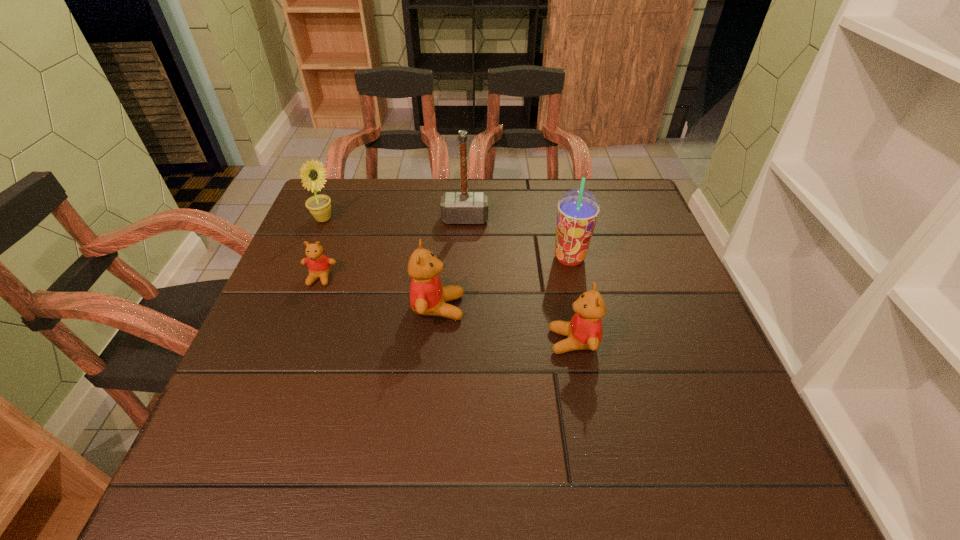
All teddy bears are currently evenly spaced. To continue this pattern, where would you add another teddy bear on the right? Please point out a vacant spot. Please provide its 2D coordinates. Your answer should be formatted as a tuple, i.e. [(x, y)], where the tuple contains the x and y coordinates of a point satisfying the conditions above.

[(731, 381)]